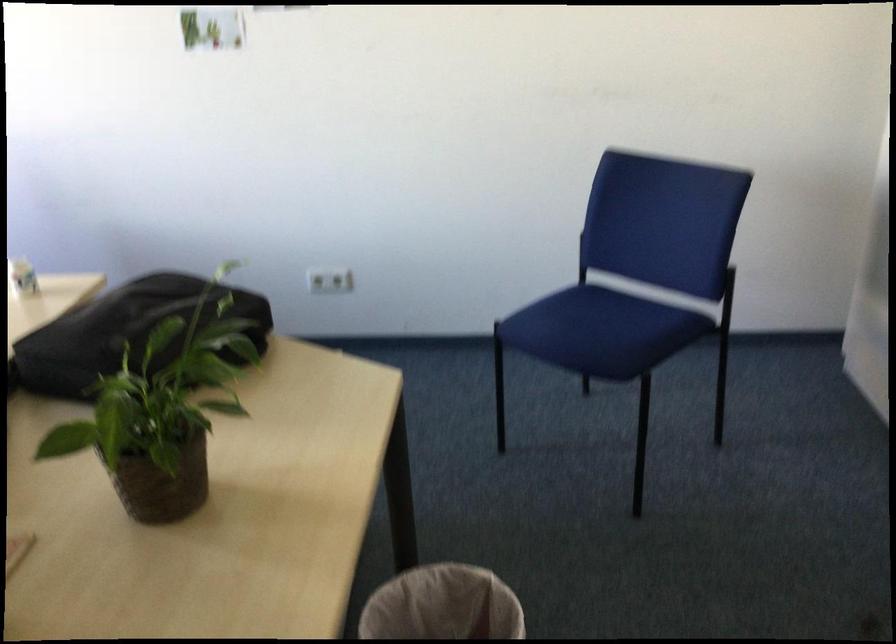
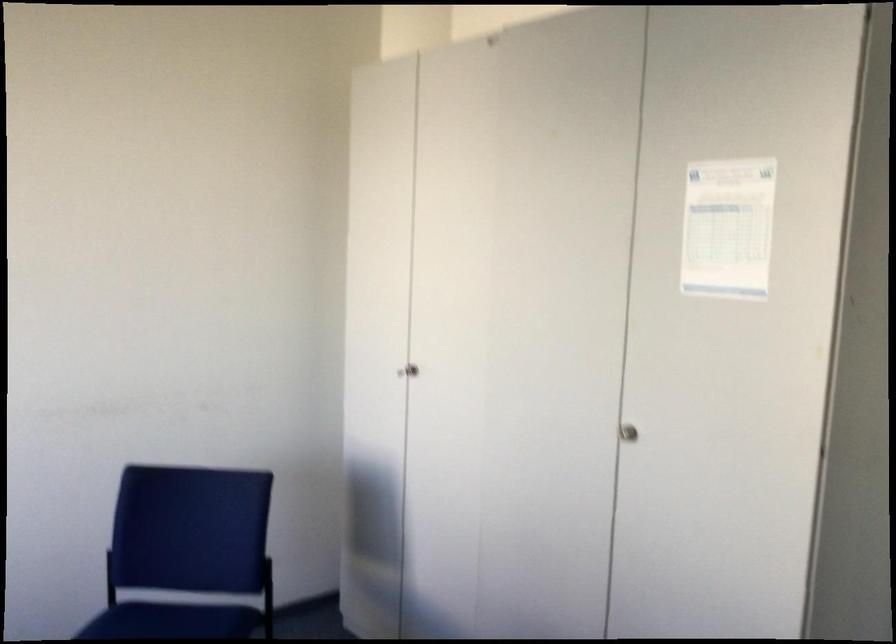
Locate, in the second image, the point that corresponds to (634,316) in the first image.

(179, 623)